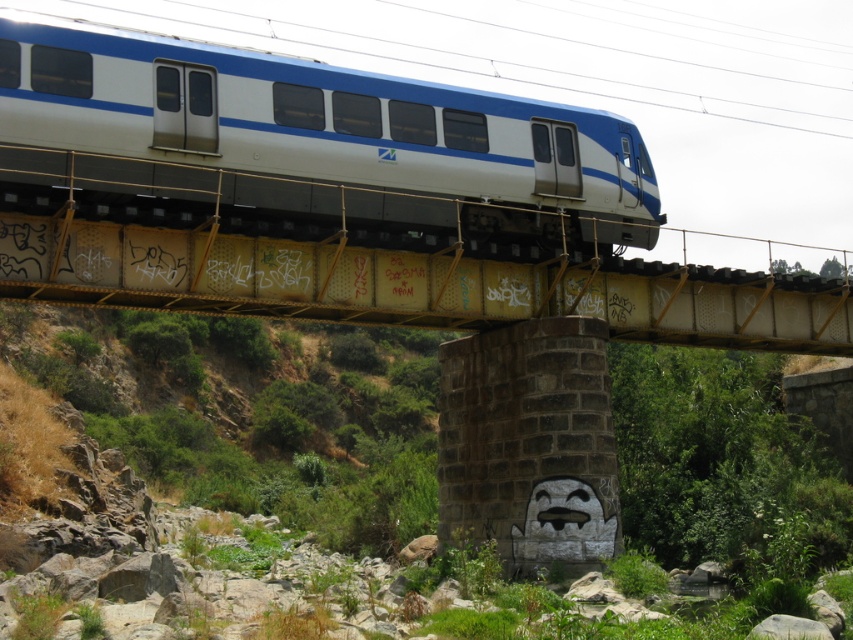
Question: Which of the following is the closest to the observer?

Choices:
 (A) green grassy hillside at lower left
 (B) white glossy train at center

Answer: (A)

Question: Does green grassy hillside at lower left come behind white glossy train at center?

Choices:
 (A) no
 (B) yes

Answer: (A)

Question: Is green grassy hillside at lower left to the right of white glossy train at center from the viewer's perspective?

Choices:
 (A) yes
 (B) no

Answer: (B)

Question: Among these points, which one is nearest to the camera?

Choices:
 (A) (387, 502)
 (B) (152, 195)

Answer: (B)

Question: Can you confirm if green grassy hillside at lower left is bigger than white glossy train at center?

Choices:
 (A) yes
 (B) no

Answer: (A)